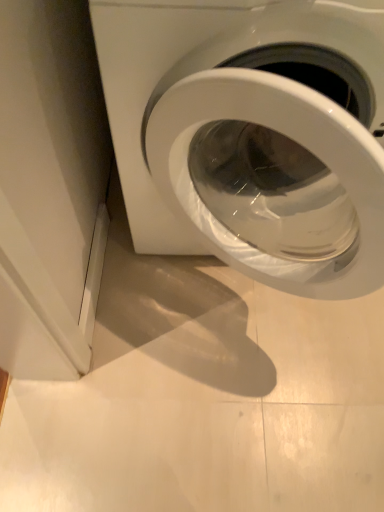
What is the approximate width of white glossy washing machine at center?

74.80 centimeters.

This screenshot has width=384, height=512. What do you see at coordinates (252, 135) in the screenshot?
I see `white glossy washing machine at center` at bounding box center [252, 135].

At what (x,y) coordinates should I click in order to perform the action: click on white glossy washing machine at center. Please return your answer as a coordinate pair (x, y). This screenshot has height=512, width=384. Looking at the image, I should click on (252, 135).

Where is `white glossy washing machine at center`? white glossy washing machine at center is located at coordinates tap(252, 135).